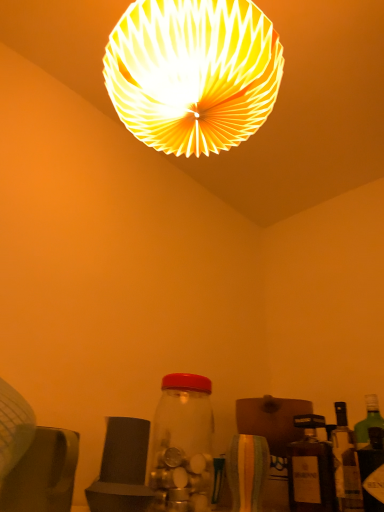
Question: Is white paper lampshade at upper center wider or thinner than green glass bottle at right, the 3th bottle positioned from the left?

Choices:
 (A) thin
 (B) wide

Answer: (B)

Question: From the image's perspective, is white paper lampshade at upper center positioned above or below green glass bottle at right, which is the first bottle from right to left?

Choices:
 (A) below
 (B) above

Answer: (B)

Question: Which object is the farthest from the green glass bottle at right, the 3th bottle positioned from the left?

Choices:
 (A) transparent glass jar at center, the first bottle when ordered from left to right
 (B) matte brown bottle at lower right, which ranks as the second bottle in left-to-right order
 (C) white paper lampshade at upper center

Answer: (C)

Question: Estimate the real-world distances between objects in this image. Which object is closer to the matte brown bottle at lower right, the 2th bottle positioned from the right?

Choices:
 (A) white paper lampshade at upper center
 (B) green glass bottle at right, the 3th bottle positioned from the left
 (C) transparent glass jar at center, the first bottle when ordered from left to right

Answer: (B)